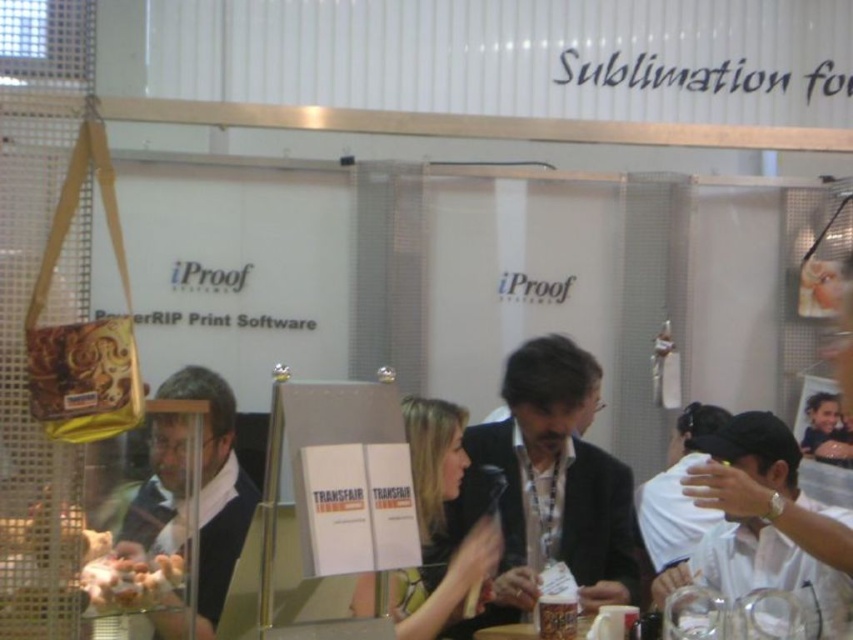
Is white fabric cap at upper right closer to camera compared to black fabric jacket at center?

No, it is not.

Who is more distant from viewer, (781, 564) or (427, 454)?

The point (427, 454) is behind.

Identify the location of white fabric cap at upper right. This screenshot has width=853, height=640. 763,522.

Does matte black sweater at center have a larger size compared to golden crispy chicken at lower left?

Indeed, matte black sweater at center has a larger size compared to golden crispy chicken at lower left.

This screenshot has height=640, width=853. I want to click on matte black sweater at center, so click(x=215, y=488).

Locate an element on the screen. This screenshot has width=853, height=640. matte black sweater at center is located at coordinates (215, 488).

Which is above, black fabric jacket at center or golden crispy chicken at lower left?

golden crispy chicken at lower left is above.

Which is behind, point (410, 444) or point (91, 560)?

The point (410, 444) is behind.

Is point (434, 416) behind point (164, 596)?

That is True.

Locate an element on the screen. black fabric jacket at center is located at coordinates (444, 586).